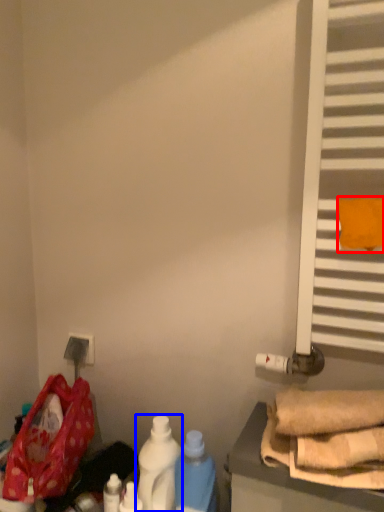
Question: Which object appears closest to the camera in this image, beach towel (highlighted by a red box) or bottle (highlighted by a blue box)?

Choices:
 (A) beach towel
 (B) bottle

Answer: (A)